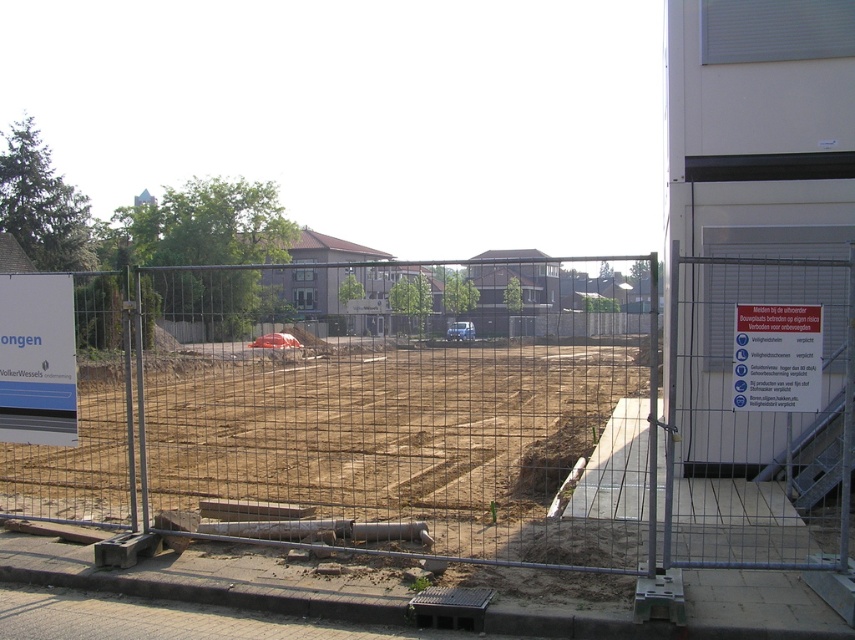
You are a surveyor standing at the construction site. You see two points marked on the ground at coordinates point (832,284) and point (805,376). Which point is closer to you?

Point (832,284) is closer to you because it is further to the viewer than point (805,376).

You are a delivery driver who needs to park your truck near the construction site. The truck is 2 meters wide. The parking spot you found is between the brown dirt at center and the white paper sign at left. Can your truck fit in this parking spot?

The brown dirt at center is to the right of white paper sign at left, but the distance between them isn not specified. Therefore, it is uncertain if the truck can fit in the parking spot between them.

You are a construction worker standing at the entrance of the construction site. You need to locate the brown dirt at center. According to the coordinates provided, where exactly should you look to find it?

The brown dirt at center is located at the 2D coordinates point (416, 445), so you should look towards that specific coordinate point to find it.